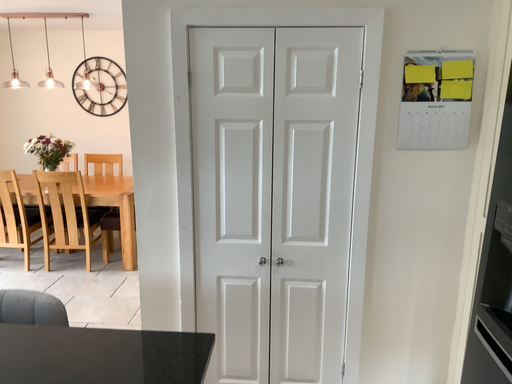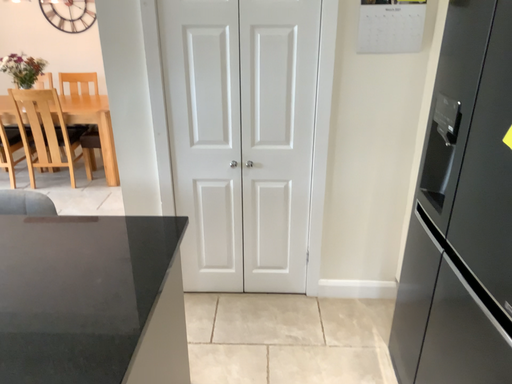
Question: Which way did the camera rotate in the video?

Choices:
 (A) rotated upward
 (B) rotated downward

Answer: (B)